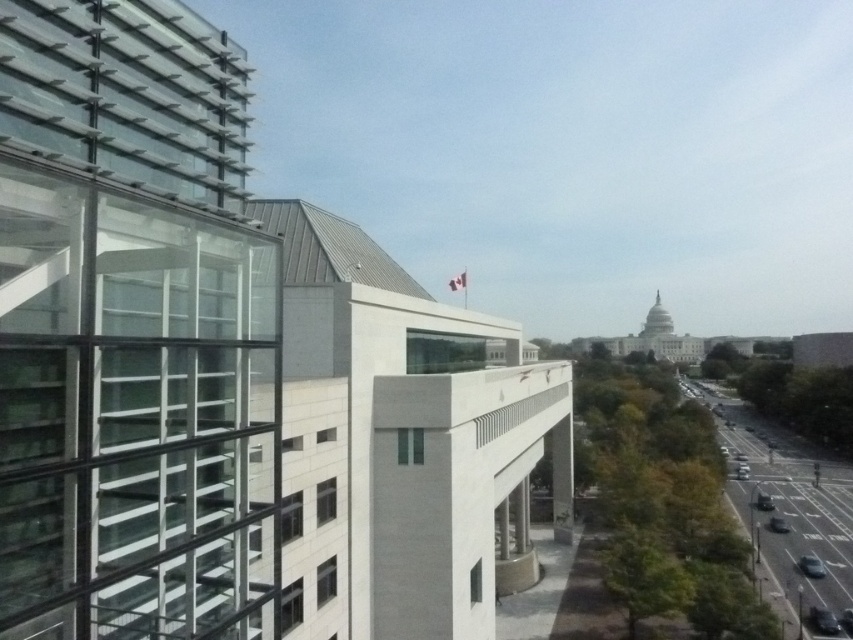
Question: Among these points, which one is nearest to the camera?

Choices:
 (A) (744, 474)
 (B) (782, 518)
 (C) (848, 634)

Answer: (C)

Question: Can you confirm if metallic silver car at lower right is wider than shiny silver car at lower right?

Choices:
 (A) yes
 (B) no

Answer: (A)

Question: From the image, what is the correct spatial relationship of silver metallic car at lower right in relation to shiny silver car at lower right?

Choices:
 (A) above
 (B) below

Answer: (A)

Question: Among these objects, which one is nearest to the camera?

Choices:
 (A) shiny black car at center
 (B) metallic silver car at lower right
 (C) shiny silver sedan at center-right

Answer: (A)

Question: Is silver metallic car at lower right wider than silver metallic sedan at center-right?

Choices:
 (A) no
 (B) yes

Answer: (A)

Question: Which point is farther to the camera?

Choices:
 (A) (830, 618)
 (B) (782, 520)
 (C) (817, 572)

Answer: (B)